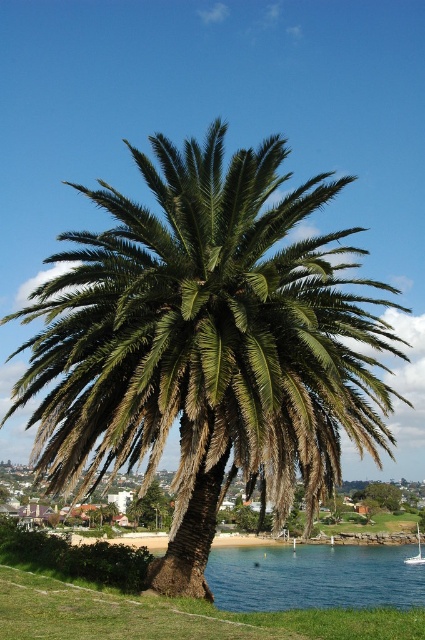
Is green leafy palm tree at center closer to camera compared to green leafy palm at center?

Yes, it is.

Between green leafy palm tree at center and green leafy palm at center, which one appears on the left side from the viewer's perspective?

green leafy palm at center

Locate an element on the screen. Image resolution: width=425 pixels, height=640 pixels. green leafy palm tree at center is located at coordinates (206, 342).

Between green leafy palm at center and white glossy sailboat at lower right, which one is positioned lower?

white glossy sailboat at lower right is below.

Does green leafy palm at center have a lesser height compared to white glossy sailboat at lower right?

In fact, green leafy palm at center may be taller than white glossy sailboat at lower right.

Does point (164, 493) lie in front of point (418, 547)?

That is True.

Identify the location of green leafy palm at center. (150, 508).

Does green leafy palm tree at center have a greater width compared to white glossy sailboat at lower right?

Correct, the width of green leafy palm tree at center exceeds that of white glossy sailboat at lower right.

Is point (297, 458) farther from viewer compared to point (405, 563)?

No, it is in front of (405, 563).

In order to click on green leafy palm tree at center in this screenshot , I will do tap(206, 342).